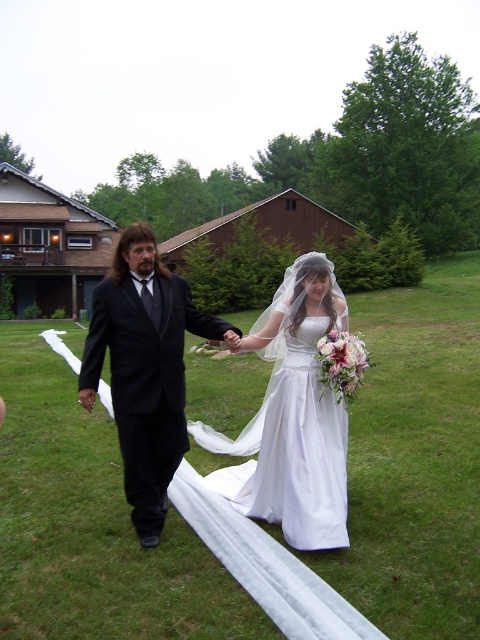
Question: Considering the real-world distances, which object is closest to the white satin veil at center?

Choices:
 (A) white satin dress at center
 (B) matte black suit at center

Answer: (A)

Question: From the image, what is the correct spatial relationship of matte black suit at center in relation to white satin veil at center?

Choices:
 (A) left
 (B) right

Answer: (B)

Question: Considering the real-world distances, which object is closest to the white satin dress at center?

Choices:
 (A) white satin veil at center
 (B) matte black suit at center

Answer: (B)

Question: Is white satin dress at center thinner than white satin veil at center?

Choices:
 (A) yes
 (B) no

Answer: (A)

Question: Can you confirm if white satin dress at center is positioned above white satin veil at center?

Choices:
 (A) yes
 (B) no

Answer: (A)

Question: Which object is farther from the camera taking this photo?

Choices:
 (A) white satin veil at center
 (B) matte black suit at center
 (C) white satin dress at center

Answer: (B)